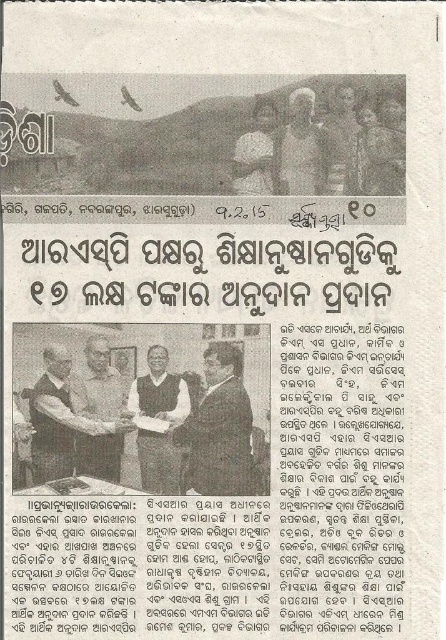
Question: Among these points, which one is farthest from the camera?

Choices:
 (A) pos(351,184)
 (B) pos(42,408)
 (C) pos(313,132)
 (D) pos(214,346)

Answer: (D)

Question: Does gray textured shirt at center have a greater width compared to light brown wooden frame at upper center?

Choices:
 (A) yes
 (B) no

Answer: (A)

Question: Which point is farther to the camera?

Choices:
 (A) light brown wooden frame at upper center
 (B) light brown leather jacket at center

Answer: (A)

Question: Which object appears farthest from the camera in this image?

Choices:
 (A) matte black shirt at center
 (B) light brown leather jacket at center
 (C) dark gray sweater at center

Answer: (A)

Question: Does light brown wooden frame at upper center have a lesser width compared to matte black shirt at center?

Choices:
 (A) yes
 (B) no

Answer: (A)

Question: Is dark gray suit at center closer to the viewer compared to matte black shirt at center?

Choices:
 (A) no
 (B) yes

Answer: (B)